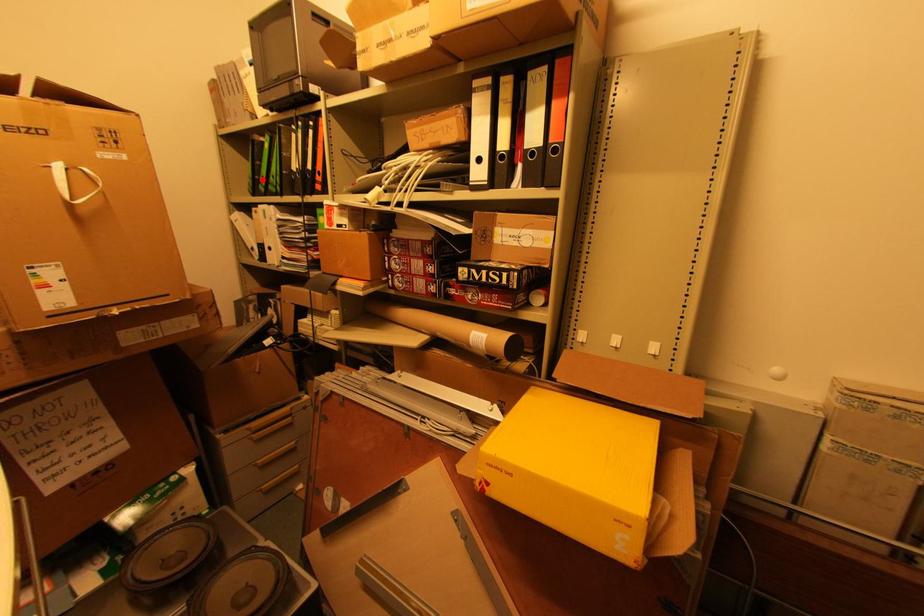
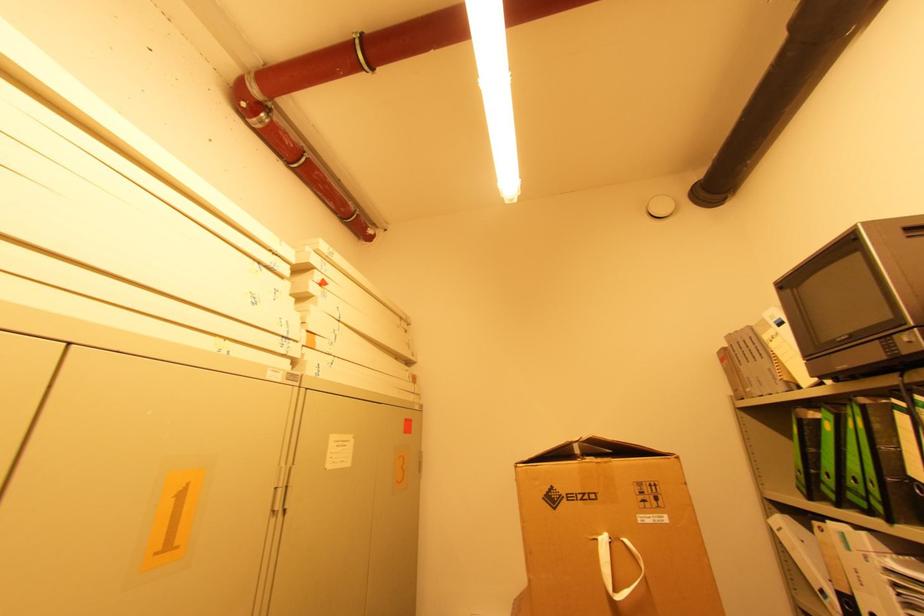
In the second image, find the point that corresponds to the highlighted location in the first image.

(822, 476)